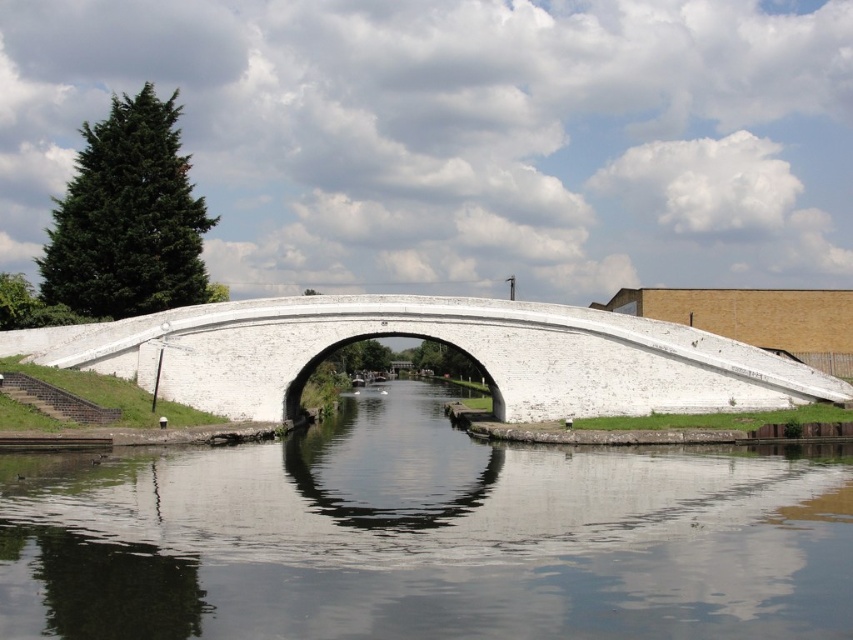
You are a boat captain trying to navigate your vessel through the canal. The boat requires a minimum width of 2 meters to pass safely. Given the description of the smooth concrete water at center and the white concrete bridge at center, can you determine if the canal is wide enough for your boat?

The smooth concrete water at center is thinner than white concrete bridge at center. Since the bridge is wider, the canal width at the bridge is sufficient for the boat requiring 2 meters.

You are an architect designing a new bridge. You observe the smooth concrete water at center and the white concrete bridge at center in the scene. Which object is taller? Please answer based on the description provided.

The white concrete bridge at center is taller than the smooth concrete water at center.